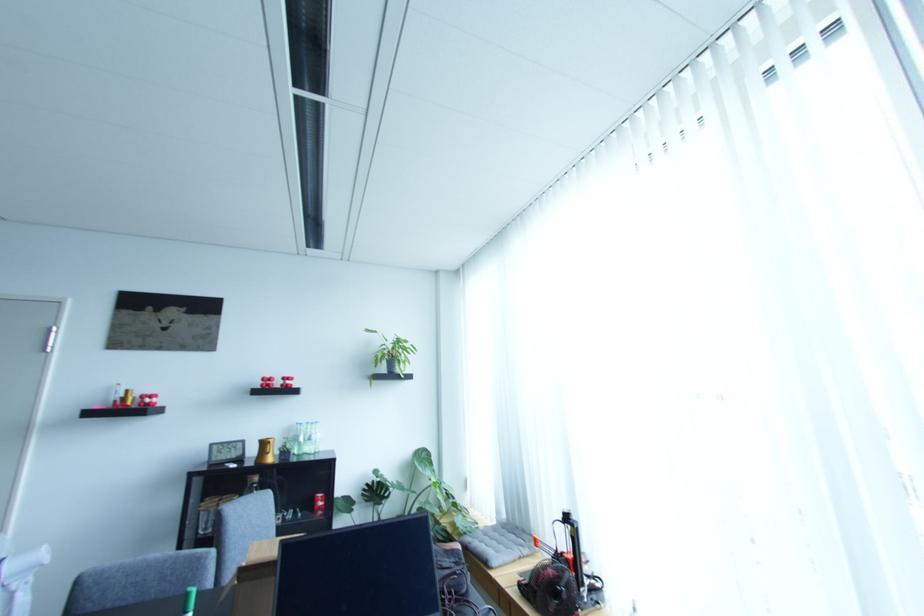
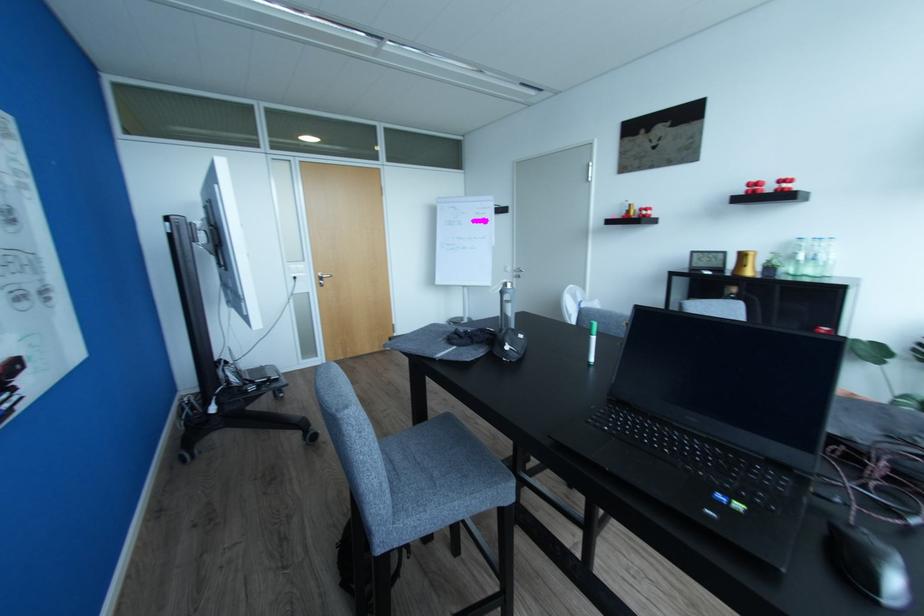
In the second image, find the point that corresponds to [317,436] in the first image.

(824, 254)